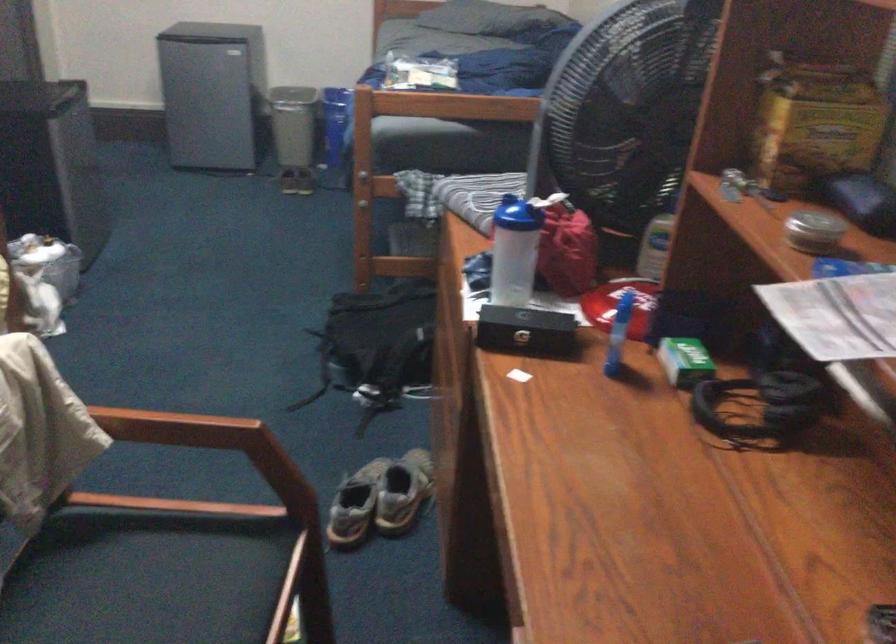
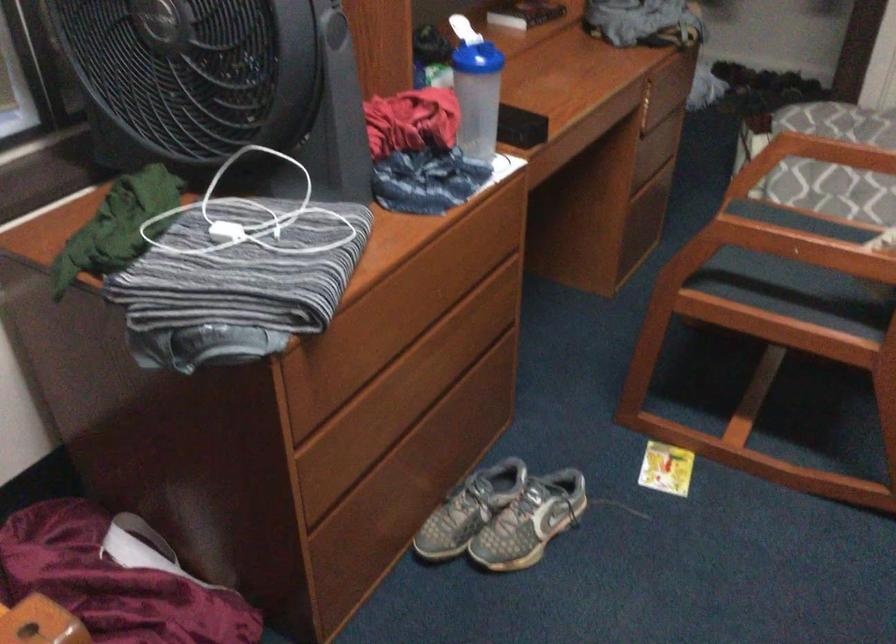
In the second image, find the point that corresponds to (x=380, y=469) in the first image.

(503, 516)